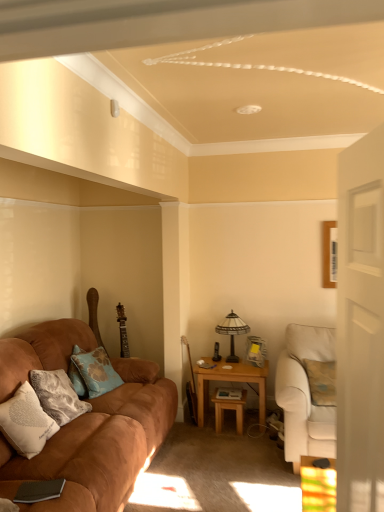
What do you see at coordinates (100, 444) in the screenshot? This screenshot has width=384, height=512. I see `suede brown couch at left, the second studio couch from the right` at bounding box center [100, 444].

Identify the location of wooden table at center, acting as the 2th table starting from the right. tap(229, 409).

The width and height of the screenshot is (384, 512). Describe the element at coordinates (92, 372) in the screenshot. I see `blue fabric pillow at left, which is counted as the second pillow, starting from the front` at that location.

This screenshot has height=512, width=384. Identify the location of white glossy door at right. (360, 348).

The image size is (384, 512). Describe the element at coordinates (232, 332) in the screenshot. I see `stained glass lampshade at center-right` at that location.

Measure the distance between point (220,331) and camera.

The depth of point (220,331) is 3.96 meters.

Identify the location of light brown wooden table at center right, which is counted as the 1th table, starting from the right. (230, 381).

Is point (22, 389) closer to viewer compared to point (243, 415)?

Yes, it is.

Is white soft pillow at lower left, the 2th pillow from the back, outside of wooden table at center, acting as the 2th table starting from the right?

white soft pillow at lower left, the 2th pillow from the back, is positioned outside wooden table at center, acting as the 2th table starting from the right.

How much distance is there between white soft pillow at lower left, the 2th pillow from the back, and wooden table at center, acting as the 2th table starting from the right?

The distance of white soft pillow at lower left, the 2th pillow from the back, from wooden table at center, acting as the 2th table starting from the right, is 1.65 meters.

Considering the relative positions of white soft pillow at lower left, arranged as the first pillow when viewed from the front, and wooden table at center, acting as the 2th table starting from the right, in the image provided, is white soft pillow at lower left, arranged as the first pillow when viewed from the front, in front of wooden table at center, acting as the 2th table starting from the right,?

Yes, it is in front of wooden table at center, acting as the 2th table starting from the right.

Is suede brown couch at left, the second studio couch from the right, thinner than white glossy door at right?

Incorrect, the width of suede brown couch at left, the second studio couch from the right, is not less than that of white glossy door at right.

From the image's perspective, between suede brown couch at left, the second studio couch from the right, and white glossy door at right, who is located below?

suede brown couch at left, the second studio couch from the right, appears lower in the image.

Which is in front, suede brown couch at left, arranged as the first studio couch when viewed from the left, or white glossy door at right?

Positioned in front is white glossy door at right.

Is suede brown couch at left, arranged as the first studio couch when viewed from the left, placed right next to white glossy door at right?

Result: suede brown couch at left, arranged as the first studio couch when viewed from the left, is not next to white glossy door at right, and they're not touching.

Do you think stained glass lampshade at center-right is within white glossy door at right, or outside of it?

stained glass lampshade at center-right is located beyond the bounds of white glossy door at right.

Does stained glass lampshade at center-right have a lesser width compared to white glossy door at right?

In fact, stained glass lampshade at center-right might be wider than white glossy door at right.

Considering the relative sizes of stained glass lampshade at center-right and white glossy door at right in the image provided, is stained glass lampshade at center-right bigger than white glossy door at right?

Indeed, stained glass lampshade at center-right has a larger size compared to white glossy door at right.

How many degrees apart are the facing directions of stained glass lampshade at center-right and white glossy door at right?

There is a 79.9-degree angle between the facing directions of stained glass lampshade at center-right and white glossy door at right.

Considering the points (104, 394) and (241, 377), which point is in front, point (104, 394) or point (241, 377)?

The point (104, 394) is closer to the camera.

How many degrees apart are the facing directions of suede brown couch at left, arranged as the first studio couch when viewed from the left, and light brown wooden table at center right, the second table when ordered from left to right?

There is a 88-degree angle between the facing directions of suede brown couch at left, arranged as the first studio couch when viewed from the left, and light brown wooden table at center right, the second table when ordered from left to right.

At what (x,y) coordinates should I click in order to perform the action: click on the 1st table below when counting from the suede brown couch at left, arranged as the first studio couch when viewed from the left (from the image's perspective). Please return your answer as a coordinate pair (x, y). Looking at the image, I should click on (230, 381).

Relative to wooden table at center, placed as the first table when sorted from left to right, is stained glass lampshade at center-right in front or behind?

stained glass lampshade at center-right is positioned farther from the viewer than wooden table at center, placed as the first table when sorted from left to right.

From a real-world perspective, between stained glass lampshade at center-right and wooden table at center, acting as the 2th table starting from the right, who is vertically higher?

stained glass lampshade at center-right is physically above.

Would you say stained glass lampshade at center-right is inside or outside wooden table at center, acting as the 2th table starting from the right?

The correct answer is: outside.

Could you tell me if light brown wooden table at center right, the second table when ordered from left to right, is turned towards wooden table at center, acting as the 2th table starting from the right?

Yes, light brown wooden table at center right, the second table when ordered from left to right, is aimed at wooden table at center, acting as the 2th table starting from the right.

Considering their positions, is light brown wooden table at center right, which is counted as the 1th table, starting from the right, located in front of or behind wooden table at center, acting as the 2th table starting from the right?

Clearly, light brown wooden table at center right, which is counted as the 1th table, starting from the right, is behind wooden table at center, acting as the 2th table starting from the right.

From a real-world perspective, is light brown wooden table at center right, the second table when ordered from left to right, located higher than wooden table at center, acting as the 2th table starting from the right?

Correct, in the physical world, light brown wooden table at center right, the second table when ordered from left to right, is higher than wooden table at center, acting as the 2th table starting from the right.

Is light brown wooden table at center right, which is counted as the 1th table, starting from the right, next to wooden table at center, placed as the first table when sorted from left to right?

light brown wooden table at center right, which is counted as the 1th table, starting from the right, is not next to wooden table at center, placed as the first table when sorted from left to right, and they're not touching.

Is point (288, 440) less distant than point (81, 368)?

That is True.

Is beige fabric armchair at right, the first studio couch positioned from the right, turned away from blue fabric pillow at left, which is counted as the second pillow, starting from the front?

beige fabric armchair at right, the first studio couch positioned from the right, does not have its back to blue fabric pillow at left, which is counted as the second pillow, starting from the front.

From a real-world perspective, which is physically below, beige fabric armchair at right, the first studio couch positioned from the right, or blue fabric pillow at left, the 1th pillow positioned from the back?

beige fabric armchair at right, the first studio couch positioned from the right.

Which object is positioned more to the right, beige fabric armchair at right, the first studio couch positioned from the right, or blue fabric pillow at left, which is counted as the second pillow, starting from the front?

beige fabric armchair at right, the first studio couch positioned from the right, is more to the right.

Where is `the 1st pillow above when counting from the wooden table at center, placed as the first table when sorted from left to right (from the image's perspective)`? This screenshot has width=384, height=512. the 1st pillow above when counting from the wooden table at center, placed as the first table when sorted from left to right (from the image's perspective) is located at coordinates (26, 422).

Identify the location of studio couch on the left of white glossy door at right. This screenshot has width=384, height=512. (100, 444).

Estimate the real-world distances between objects in this image. Which object is further from beige fabric armchair at right, marked as the second studio couch in a left-to-right arrangement, wooden table at center, acting as the 2th table starting from the right, or white soft pillow at lower left, arranged as the first pillow when viewed from the front?

Among the two, white soft pillow at lower left, arranged as the first pillow when viewed from the front, is located further to beige fabric armchair at right, marked as the second studio couch in a left-to-right arrangement.

Based on their spatial positions, is light brown wooden table at center right, which is counted as the 1th table, starting from the right, or suede brown couch at left, arranged as the first studio couch when viewed from the left, further from beige fabric armchair at right, the first studio couch positioned from the right?

suede brown couch at left, arranged as the first studio couch when viewed from the left.

From the image, which object appears to be farther from stained glass lampshade at center-right, blue fabric pillow at left, the 1th pillow positioned from the back, or white glossy door at right?

Based on the image, white glossy door at right appears to be further to stained glass lampshade at center-right.

Looking at the image, which one is located closer to suede brown couch at left, the second studio couch from the right, white soft pillow at lower left, the 2th pillow from the back, or beige fabric armchair at right, the first studio couch positioned from the right?

white soft pillow at lower left, the 2th pillow from the back, is closer to suede brown couch at left, the second studio couch from the right.

When comparing their distances from wooden table at center, acting as the 2th table starting from the right, does light brown wooden table at center right, which is counted as the 1th table, starting from the right, or white glossy door at right seem further?

Among the two, white glossy door at right is located further to wooden table at center, acting as the 2th table starting from the right.

Which object lies nearer to the anchor point light brown wooden table at center right, which is counted as the 1th table, starting from the right, stained glass lampshade at center-right or blue fabric pillow at left, which is counted as the second pillow, starting from the front?

Among the two, stained glass lampshade at center-right is located nearer to light brown wooden table at center right, which is counted as the 1th table, starting from the right.

Looking at the image, which one is located further to light brown wooden table at center right, the second table when ordered from left to right, suede brown couch at left, the second studio couch from the right, or wooden table at center, acting as the 2th table starting from the right?

Based on the image, suede brown couch at left, the second studio couch from the right, appears to be further to light brown wooden table at center right, the second table when ordered from left to right.

Looking at the image, which one is located closer to suede brown couch at left, arranged as the first studio couch when viewed from the left, stained glass lampshade at center-right or white glossy door at right?

The object closer to suede brown couch at left, arranged as the first studio couch when viewed from the left, is stained glass lampshade at center-right.

Where is `table lamp between blue fabric pillow at left, which is counted as the second pillow, starting from the front, and beige fabric armchair at right, the first studio couch positioned from the right`? The height and width of the screenshot is (512, 384). table lamp between blue fabric pillow at left, which is counted as the second pillow, starting from the front, and beige fabric armchair at right, the first studio couch positioned from the right is located at coordinates (232, 332).

Identify the location of table between white soft pillow at lower left, the 2th pillow from the back, and light brown wooden table at center right, which is counted as the 1th table, starting from the right, in the horizontal direction. This screenshot has width=384, height=512. (229, 409).

Locate an element on the screen. This screenshot has height=512, width=384. table lamp between white soft pillow at lower left, arranged as the first pillow when viewed from the front, and beige fabric armchair at right, the first studio couch positioned from the right is located at coordinates (232, 332).

Locate an element on the screen. pillow between white glossy door at right and beige fabric armchair at right, marked as the second studio couch in a left-to-right arrangement, in the front-back direction is located at coordinates (26, 422).